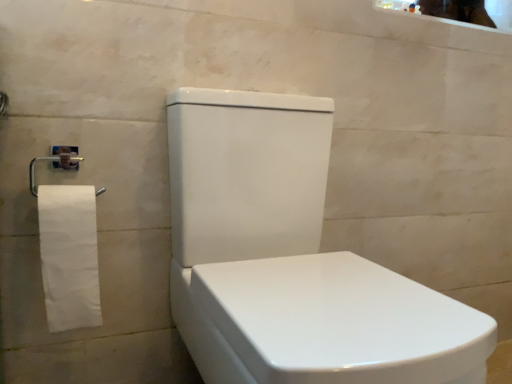
Question: Can you confirm if glossy ceramic mirror at upper right is smaller than white glossy toilet at center?

Choices:
 (A) no
 (B) yes

Answer: (B)

Question: From the image's perspective, is glossy ceramic mirror at upper right above white glossy toilet at center?

Choices:
 (A) yes
 (B) no

Answer: (A)

Question: Is the position of glossy ceramic mirror at upper right less distant than that of white glossy toilet at center?

Choices:
 (A) no
 (B) yes

Answer: (A)

Question: Can you confirm if glossy ceramic mirror at upper right is wider than white glossy toilet at center?

Choices:
 (A) no
 (B) yes

Answer: (A)

Question: Is glossy ceramic mirror at upper right looking in the opposite direction of white glossy toilet at center?

Choices:
 (A) no
 (B) yes

Answer: (A)

Question: Is glossy ceramic mirror at upper right at the left side of white glossy toilet at center?

Choices:
 (A) yes
 (B) no

Answer: (B)

Question: From the image's perspective, is white matte toilet paper at left beneath glossy ceramic mirror at upper right?

Choices:
 (A) no
 (B) yes

Answer: (B)

Question: Can you confirm if white matte toilet paper at left is bigger than glossy ceramic mirror at upper right?

Choices:
 (A) no
 (B) yes

Answer: (A)

Question: Is there a large distance between white matte toilet paper at left and glossy ceramic mirror at upper right?

Choices:
 (A) yes
 (B) no

Answer: (A)

Question: Is white matte toilet paper at left smaller than glossy ceramic mirror at upper right?

Choices:
 (A) yes
 (B) no

Answer: (A)

Question: Is white matte toilet paper at left to the left of glossy ceramic mirror at upper right from the viewer's perspective?

Choices:
 (A) no
 (B) yes

Answer: (B)

Question: From the image's perspective, is white matte toilet paper at left located above glossy ceramic mirror at upper right?

Choices:
 (A) yes
 (B) no

Answer: (B)

Question: Considering the relative positions of white matte toilet paper at left and white glossy toilet at center in the image provided, is white matte toilet paper at left behind white glossy toilet at center?

Choices:
 (A) no
 (B) yes

Answer: (B)